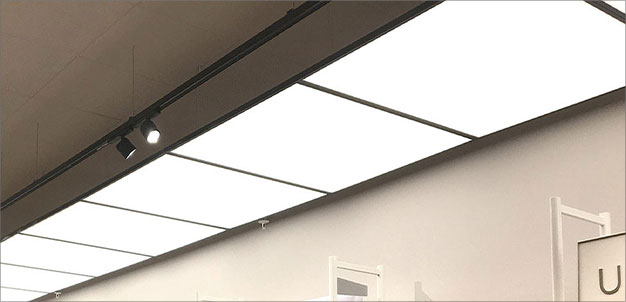
Find the location of a particular element. empty space above lights is located at coordinates (257, 69).